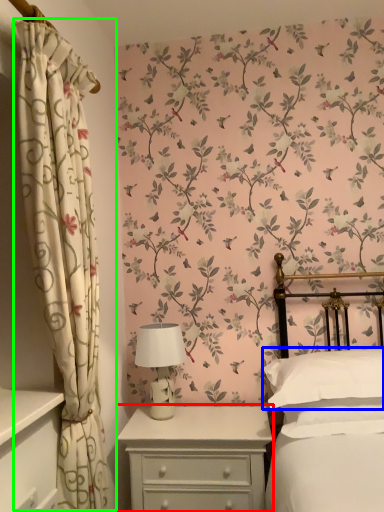
Question: Based on their relative distances, which object is farther from nightstand (highlighted by a red box)? Choose from pillow (highlighted by a blue box) and curtain (highlighted by a green box).

Choices:
 (A) pillow
 (B) curtain

Answer: (B)